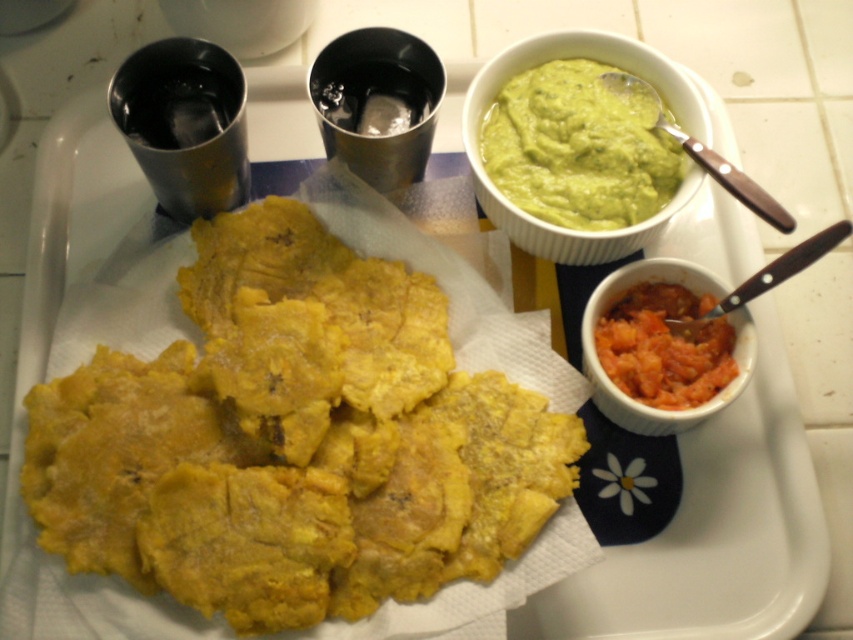
You need to place a 30 cm ruler between the yellow fried plantains at center and the green smooth guacamole at upper right. Can the ruler fit entirely between them without overlapping either?

The distance between the yellow fried plantains at center and the green smooth guacamole at upper right is 29.81 centimeters. Since the ruler is 30 cm long, it cannot fit entirely between them without overlapping either object because the distance is slightly shorter than the ruler.

You are a food critic standing at a distance of 36 inches from the tray. You want to taste the green smooth guacamole at upper right. Can you reach it without moving closer?

The green smooth guacamole at upper right is 36.53 inches away from the camera, so if you are standing 36 inches away, you are slightly closer than the distance to the guacamole. Therefore, you can likely reach it without moving closer.

You are a food delivery person who needs to know if the yellow fried plantains at center will fit on a 12cm diameter plate. The smooth orange puree at lower right is also on the tray. What should you do?

The yellow fried plantains at center is larger in size than the smooth orange puree at lower right. Since the plate has a 12cm diameter, you should check the actual size of the yellow fried plantains at center to ensure it fits before transferring.